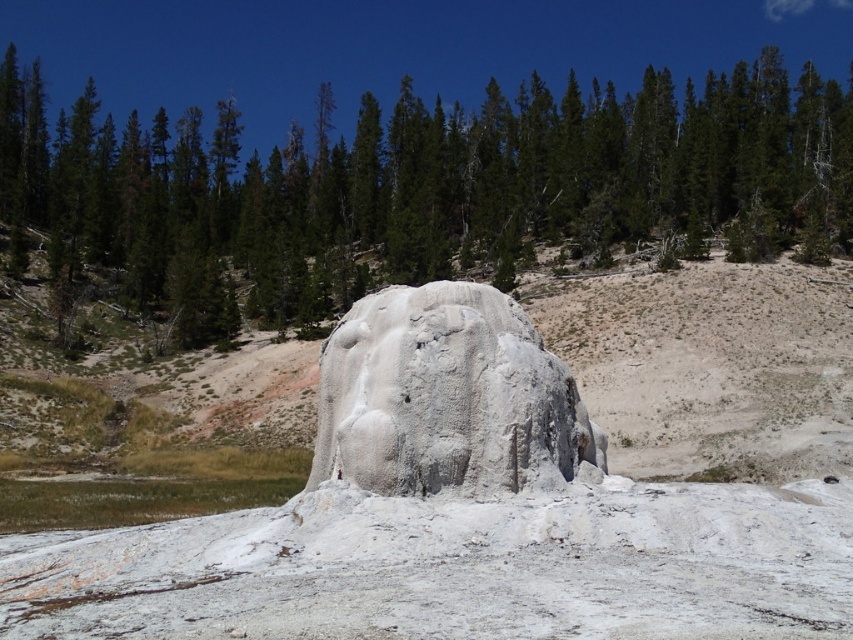
In the scene shown: You are a geologist examining the image. You need to determine the spatial relationship between the green leafy trees at center and the white textured rock at center. Which object is positioned higher in the image?

The green leafy trees at center are located above the white textured rock at center, so the green leafy trees at center are positioned higher in the image.

In the scene shown: You are standing at the base of the large white conical structure in the image. You want to walk towards the dense forest of evergreen trees in the background. Which direction should you walk relative to the point at coordinates point (422, 189)?

The point at coordinates point (422, 189) is on green leafy trees at center. Since the dense forest of evergreen trees is in the background, you should walk towards the direction of the point at coordinates point (422, 189) to reach the dense forest of evergreen trees.

You are a hiker who wants to place a 100 meter long tent between the green leafy trees at center and the white textured rock at center. Can you fit the tent between them?

The distance between the green leafy trees at center and the white textured rock at center is 72.34 meters, which is shorter than the 100 meter long tent. Therefore, the tent cannot be placed between them.